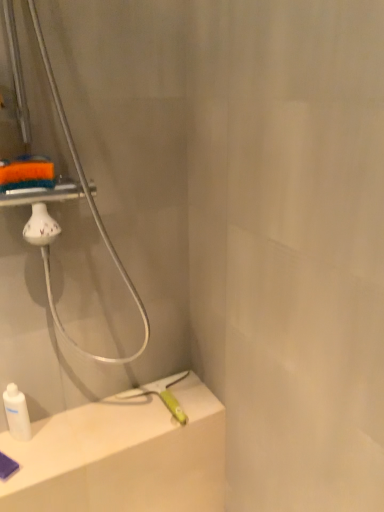
Question: From their relative heights in the image, would you say white glossy bottle at lower left is taller or shorter than white matte counter top at lower left?

Choices:
 (A) short
 (B) tall

Answer: (B)

Question: Relative to white matte counter top at lower left, is white glossy bottle at lower left in front or behind?

Choices:
 (A) behind
 (B) front

Answer: (A)

Question: In terms of width, does white glossy bottle at lower left look wider or thinner when compared to white matte counter top at lower left?

Choices:
 (A) wide
 (B) thin

Answer: (B)

Question: From the image's perspective, is white matte counter top at lower left located above or below white glossy bottle at lower left?

Choices:
 (A) below
 (B) above

Answer: (A)

Question: Considering the positions of white matte counter top at lower left and white glossy bottle at lower left in the image, is white matte counter top at lower left wider or thinner than white glossy bottle at lower left?

Choices:
 (A) wide
 (B) thin

Answer: (A)

Question: Looking at the image, does white matte counter top at lower left seem bigger or smaller compared to white glossy bottle at lower left?

Choices:
 (A) small
 (B) big

Answer: (B)

Question: Visually, is white matte counter top at lower left positioned to the left or to the right of white glossy bottle at lower left?

Choices:
 (A) right
 (B) left

Answer: (A)